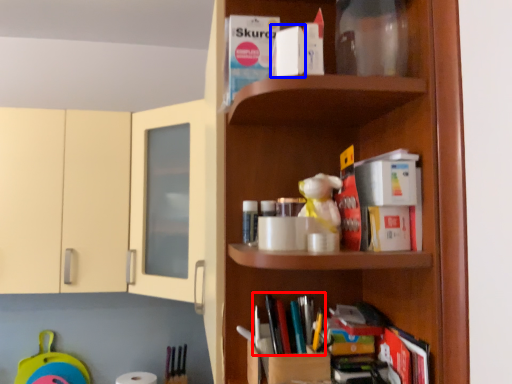
Question: Which object appears closest to the camera in this image, book (highlighted by a red box) or book (highlighted by a blue box)?

Choices:
 (A) book
 (B) book

Answer: (B)